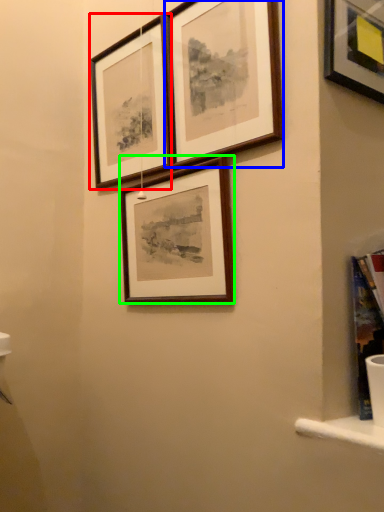
Question: Which object is positioned closest to picture frame (highlighted by a red box)? Select from picture frame (highlighted by a blue box) and picture frame (highlighted by a green box).

Choices:
 (A) picture frame
 (B) picture frame

Answer: (A)